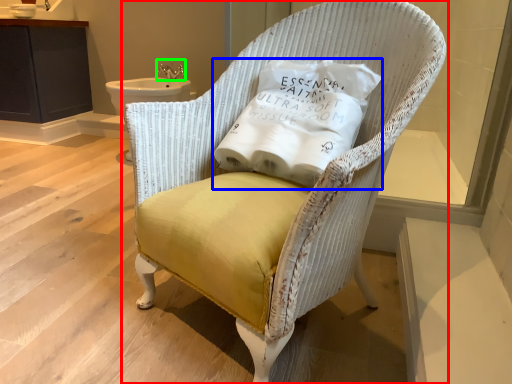
Question: Which object is the farthest from chair (highlighted by a red box)? Choose among these: pillow (highlighted by a blue box) or faucet (highlighted by a green box).

Choices:
 (A) pillow
 (B) faucet

Answer: (B)